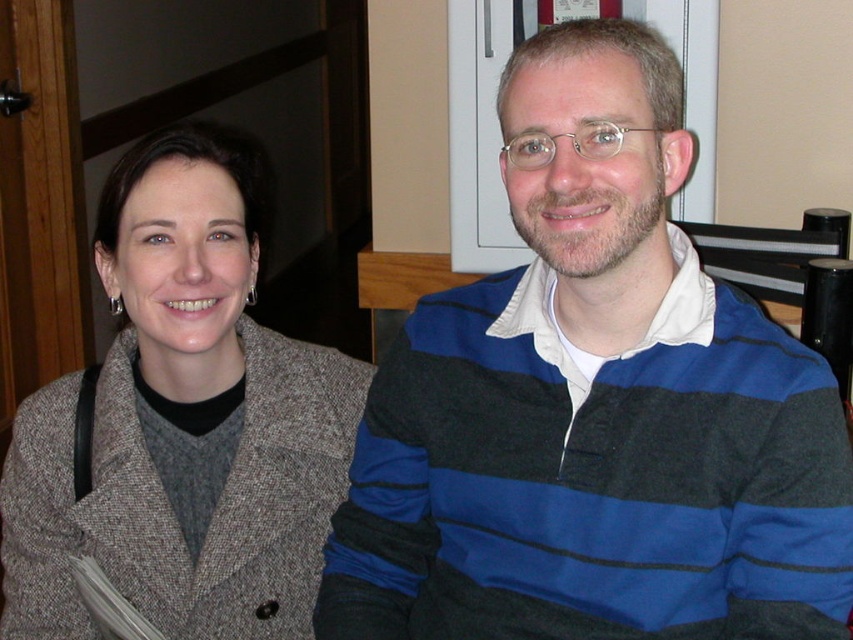
Does blue striped sweater at center have a smaller size compared to matte gray coat at center?

Incorrect, blue striped sweater at center is not smaller in size than matte gray coat at center.

Who is taller, blue striped sweater at center or matte gray coat at center?

Standing taller between the two is matte gray coat at center.

Does point (395, 614) come closer to viewer compared to point (154, 218)?

Yes, it is.

At what (x,y) coordinates should I click in order to perform the action: click on blue striped sweater at center. Please return your answer as a coordinate pair (x, y). Looking at the image, I should click on (595, 406).